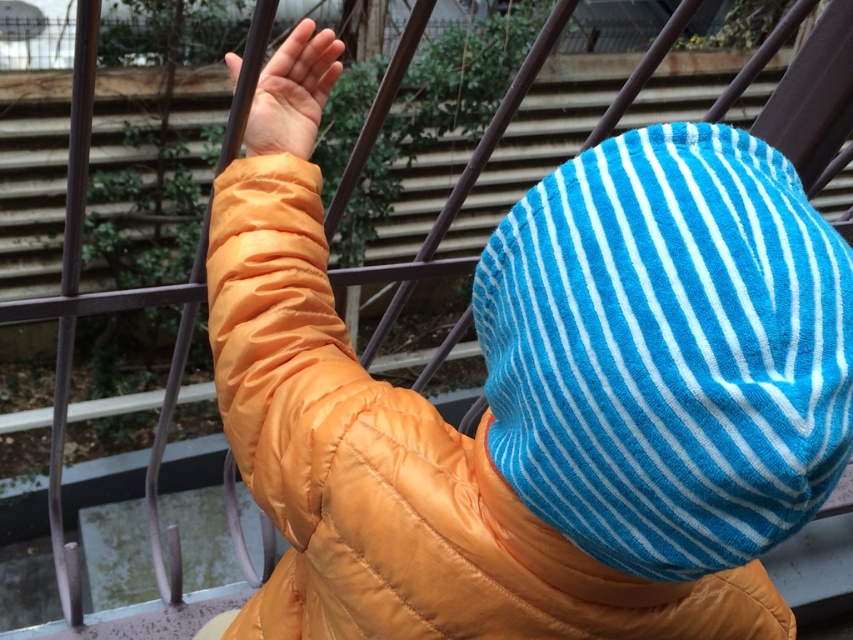
Is point (286, 534) positioned behind point (299, 148)?

No.

Who is lower down, blue striped hat at center or orange matte hand at upper center?

blue striped hat at center is below.

Is point (630, 620) positioned before point (253, 106)?

Yes, it is.

Image resolution: width=853 pixels, height=640 pixels. In order to click on blue striped hat at center in this screenshot , I will do click(x=535, y=417).

Is blue striped towel at upper center closer to the viewer compared to orange matte hand at upper center?

That is True.

Is the position of blue striped towel at upper center more distant than that of orange matte hand at upper center?

No, it is not.

Does point (646, 481) come closer to viewer compared to point (257, 92)?

Yes.

What are the coordinates of `blue striped towel at upper center` in the screenshot? It's located at (668, 349).

Can you confirm if blue striped hat at center is positioned below blue striped towel at upper center?

Indeed, blue striped hat at center is positioned under blue striped towel at upper center.

Who is higher up, blue striped hat at center or blue striped towel at upper center?

blue striped towel at upper center

Between point (698, 458) and point (643, 284), which one is positioned behind?

Positioned behind is point (643, 284).

Identify the location of blue striped hat at center. (535, 417).